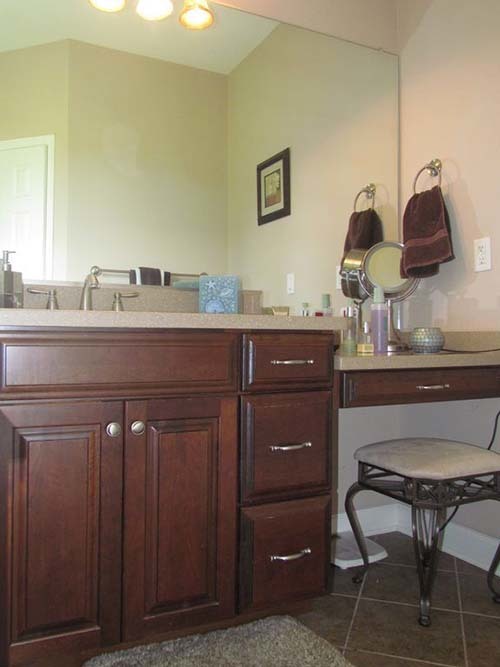
Locate an element on the screen. places to sit is located at coordinates (429, 453).